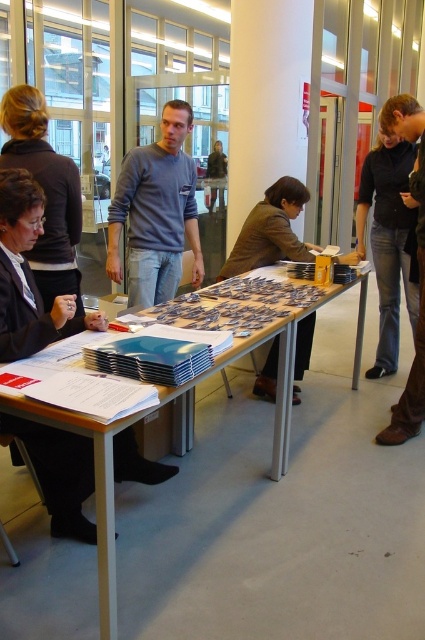
Question: Does gray cotton sweater at center have a greater width compared to brown fabric jacket at center?

Choices:
 (A) yes
 (B) no

Answer: (B)

Question: Estimate the real-world distances between objects in this image. Which object is closer to the wooden table at center?

Choices:
 (A) dark brown hair at upper left
 (B) matte black jacket at lower left
 (C) gray cotton sweater at center

Answer: (B)

Question: Which is farther from the matte black jacket at lower left?

Choices:
 (A) dark brown leather jacket at upper right
 (B) gray cotton sweater at center
 (C) wooden table at center
 (D) matte gray sweater at center

Answer: (D)

Question: Can you confirm if wooden table at center is wider than dark brown leather jacket at upper right?

Choices:
 (A) yes
 (B) no

Answer: (A)

Question: Can you confirm if wooden table at center is positioned to the right of dark brown hair at upper left?

Choices:
 (A) yes
 (B) no

Answer: (A)

Question: Based on their relative distances, which object is farther from the dark brown leather jacket at upper right?

Choices:
 (A) matte gray sweater at center
 (B) dark brown hair at upper left
 (C) gray cotton sweater at center
 (D) brown fabric jacket at center

Answer: (A)